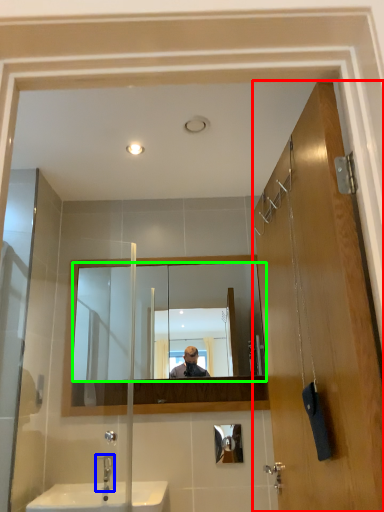
Question: Based on their relative distances, which object is nearer to door (highlighted by a red box)? Choose from tap (highlighted by a blue box) and mirror (highlighted by a green box).

Choices:
 (A) tap
 (B) mirror

Answer: (B)